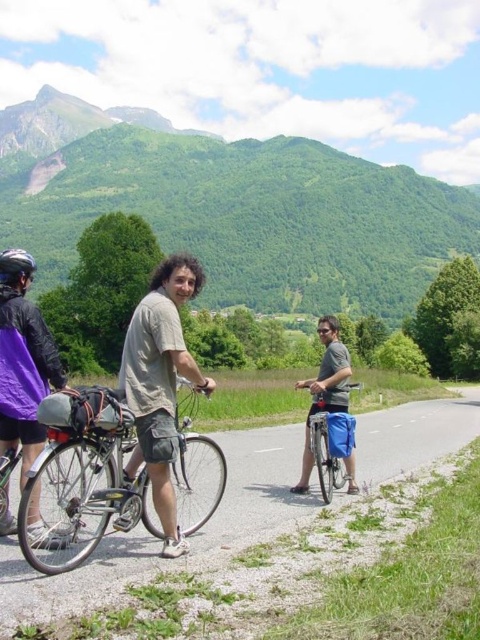
Question: Which point is farther from the camera taking this photo?

Choices:
 (A) coord(109,488)
 (B) coord(232,154)
 (C) coord(0,340)

Answer: (B)

Question: Among these points, which one is nearest to the camera?

Choices:
 (A) (57, 580)
 (B) (35, 106)

Answer: (A)

Question: Which object is closer to the camera taking this photo?

Choices:
 (A) black matte bicycle helmet at left
 (B) light brown cotton shirt at center
 (C) green grassy mountain at upper center

Answer: (B)

Question: Does blue fabric bag at center appear on the left side of black matte bicycle helmet at left?

Choices:
 (A) no
 (B) yes

Answer: (A)

Question: Is blue fabric bag at center to the left of black matte bicycle helmet at left from the viewer's perspective?

Choices:
 (A) no
 (B) yes

Answer: (A)

Question: Can you confirm if green grassy mountain at upper center is bigger than light brown cotton shirt at center?

Choices:
 (A) no
 (B) yes

Answer: (B)